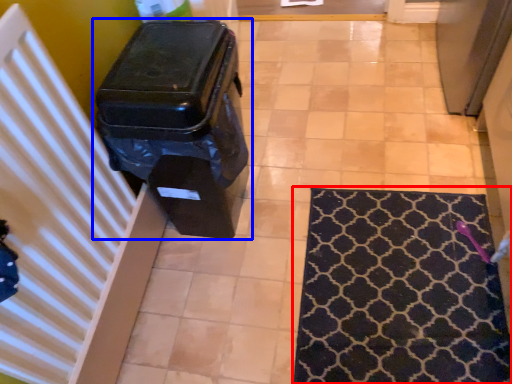
Question: Which object is further to the camera taking this photo, mat (highlighted by a red box) or waste container (highlighted by a blue box)?

Choices:
 (A) mat
 (B) waste container

Answer: (A)